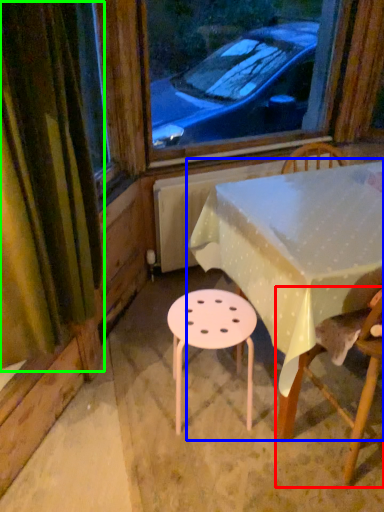
Question: Based on their relative distances, which object is nearer to chair (highlighted by a red box)? Choose from table (highlighted by a blue box) and curtain (highlighted by a green box).

Choices:
 (A) table
 (B) curtain

Answer: (A)